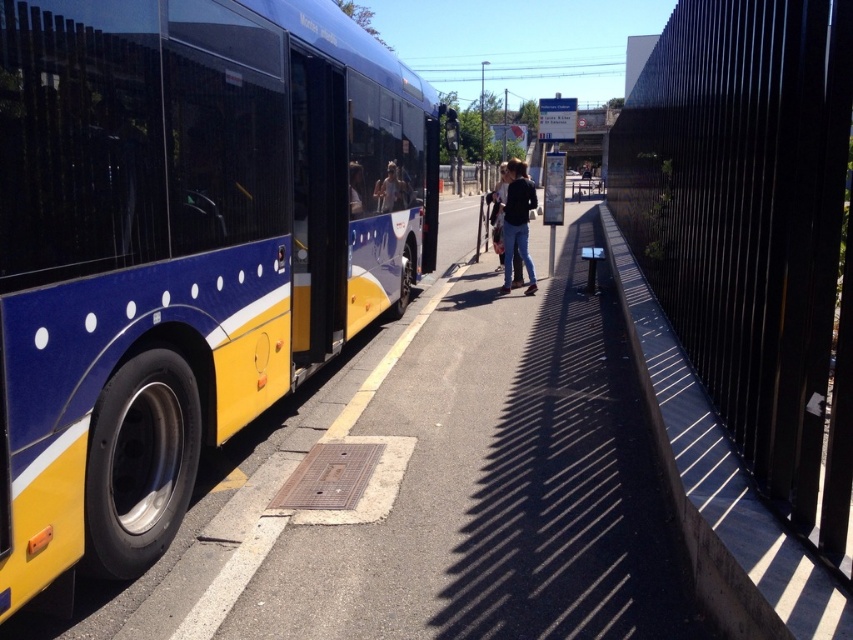
You are a delivery person trying to park your van near the bus stop. You see the smooth asphalt pavement at center and the black concrete curb at right. Which surface can your van safely park on?

The smooth asphalt pavement at center is suitable for parking, while the black concrete curb at right is behind it and likely not a drivable surface, so park on the smooth asphalt pavement at center.